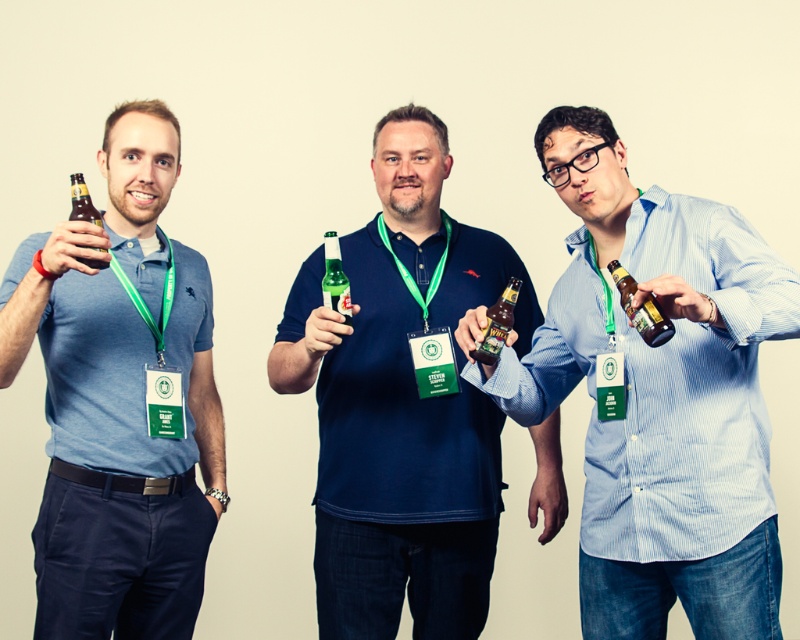
You are standing at the point with coordinates point (48, 403) and want to walk to the point with coordinates point (400, 260). According to the scene description, will you need to walk forward or backward to reach your destination?

Since point (48, 403) is in front of point (400, 260), you would need to walk backward to reach the destination point (400, 260) from your current position at point (48, 403).

What is the color of the shirt where the point at coordinates (120, 401) is located?

The point at coordinates (120, 401) is located on a matte blue shirt at left.

You are standing in front of the three people in the scene. You need to hand a document to the person holding the brown glass bottle at center. Where should you walk to deliver the document?

The brown glass bottle at center is located at point (498, 323), so you should walk to the central figure to deliver the document.